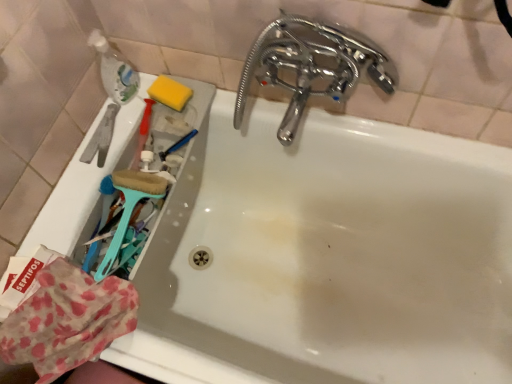
Question: Does chrome/metallic faucet at upper right appear on the right side of translucent plastic bottle at upper left?

Choices:
 (A) yes
 (B) no

Answer: (A)

Question: Is chrome/metallic faucet at upper right positioned before translucent plastic bottle at upper left?

Choices:
 (A) no
 (B) yes

Answer: (B)

Question: Does chrome/metallic faucet at upper right turn towards translucent plastic bottle at upper left?

Choices:
 (A) yes
 (B) no

Answer: (B)

Question: Considering the relative sizes of chrome/metallic faucet at upper right and translucent plastic bottle at upper left in the image provided, is chrome/metallic faucet at upper right thinner than translucent plastic bottle at upper left?

Choices:
 (A) no
 (B) yes

Answer: (A)

Question: From a real-world perspective, is chrome/metallic faucet at upper right physically above translucent plastic bottle at upper left?

Choices:
 (A) yes
 (B) no

Answer: (A)

Question: From the image's perspective, relative to polka dot fabric at lower left, is translucent plastic bottle at upper left above or below?

Choices:
 (A) above
 (B) below

Answer: (A)

Question: Would you say translucent plastic bottle at upper left is to the left or to the right of polka dot fabric at lower left in the picture?

Choices:
 (A) left
 (B) right

Answer: (B)

Question: From a real-world perspective, relative to polka dot fabric at lower left, is translucent plastic bottle at upper left vertically above or below?

Choices:
 (A) above
 (B) below

Answer: (A)

Question: Considering their positions, is translucent plastic bottle at upper left located in front of or behind polka dot fabric at lower left?

Choices:
 (A) behind
 (B) front

Answer: (A)

Question: From the image's perspective, is teal plastic brush at left located above or below translucent plastic bottle at upper left?

Choices:
 (A) above
 (B) below

Answer: (B)

Question: From a real-world perspective, is teal plastic brush at left above or below translucent plastic bottle at upper left?

Choices:
 (A) above
 (B) below

Answer: (B)

Question: Is teal plastic brush at left in front of or behind translucent plastic bottle at upper left in the image?

Choices:
 (A) behind
 (B) front

Answer: (B)

Question: Is teal plastic brush at left wider or thinner than translucent plastic bottle at upper left?

Choices:
 (A) thin
 (B) wide

Answer: (B)

Question: From the image's perspective, relative to chrome/metallic faucet at upper right, is polka dot fabric at lower left above or below?

Choices:
 (A) below
 (B) above

Answer: (A)

Question: Is polka dot fabric at lower left bigger or smaller than chrome/metallic faucet at upper right?

Choices:
 (A) big
 (B) small

Answer: (B)